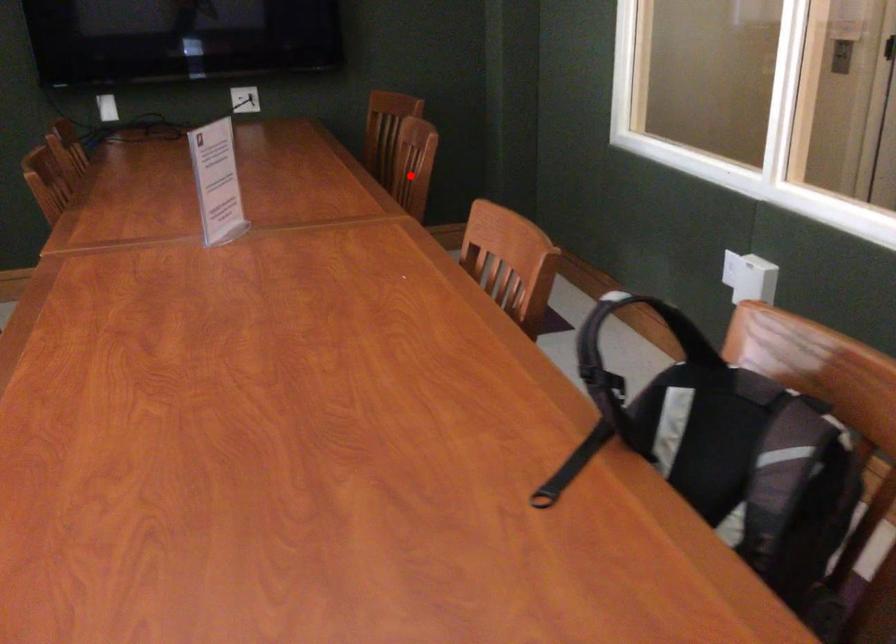
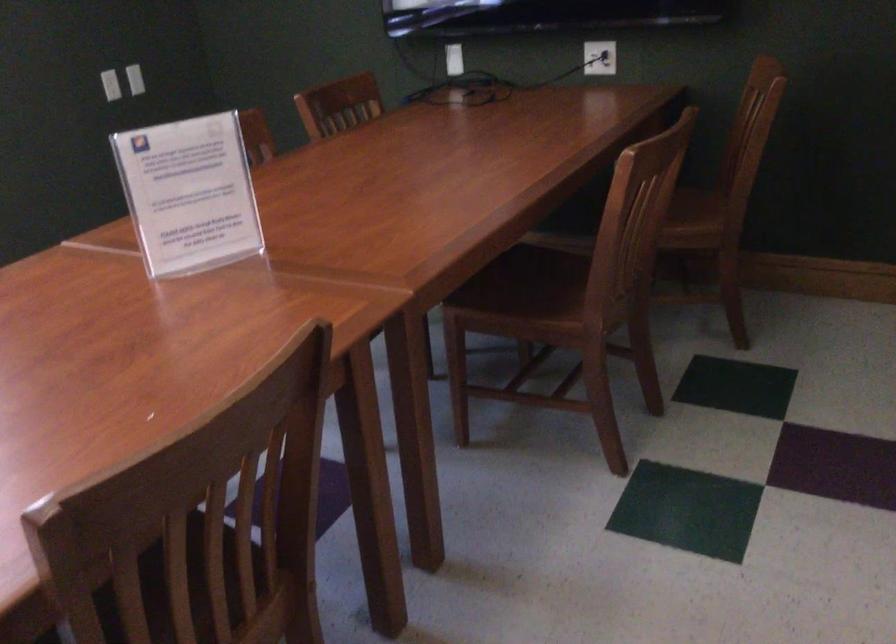
Question: I am providing you with two images of the same scene from different viewpoints. Image1 has a red point marked. In image2, the corresponding 3D location appears at what relative position? Reply with the corresponding letter.

Choices:
 (A) Closer
 (B) Farther

Answer: (A)